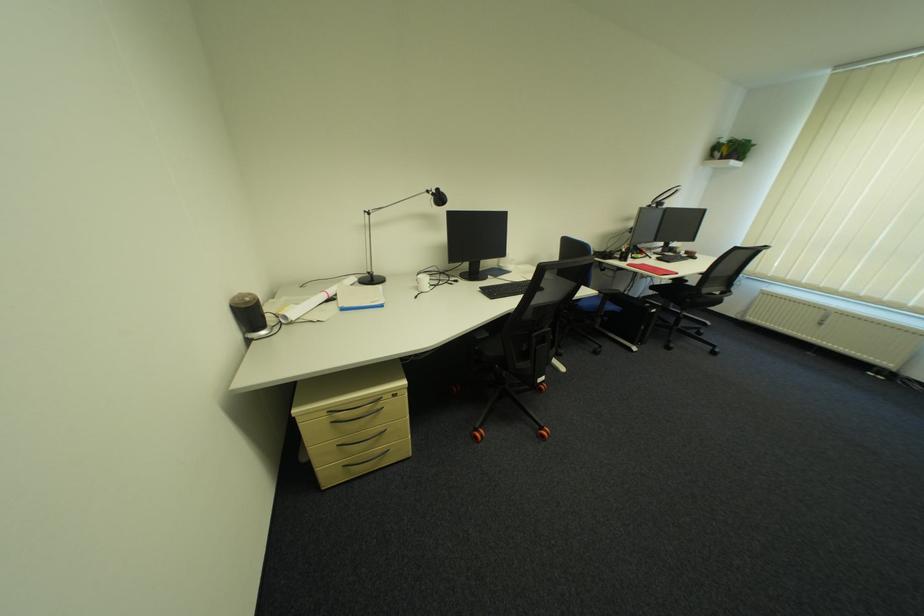
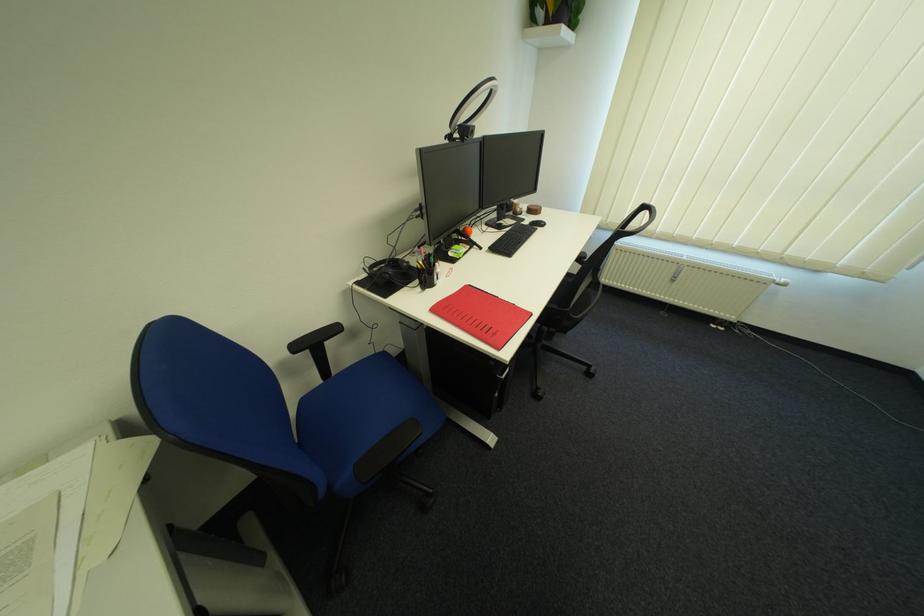
The point at (652, 257) is marked in the first image. Where is the corresponding point in the second image?

(479, 248)